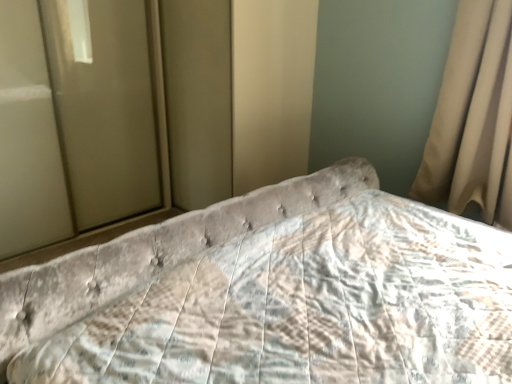
Question: From the image's perspective, relative to beige fabric curtain at right, is velvet tufted headboard at center above or below?

Choices:
 (A) above
 (B) below

Answer: (B)

Question: Considering the positions of velvet tufted headboard at center and beige fabric curtain at right in the image, is velvet tufted headboard at center bigger or smaller than beige fabric curtain at right?

Choices:
 (A) small
 (B) big

Answer: (B)

Question: Which object is the closest to the matte glass door at left?

Choices:
 (A) beige fabric curtain at right
 (B) velvet tufted headboard at center

Answer: (B)

Question: Which is farther from the velvet tufted headboard at center?

Choices:
 (A) matte glass door at left
 (B) beige fabric curtain at right

Answer: (A)